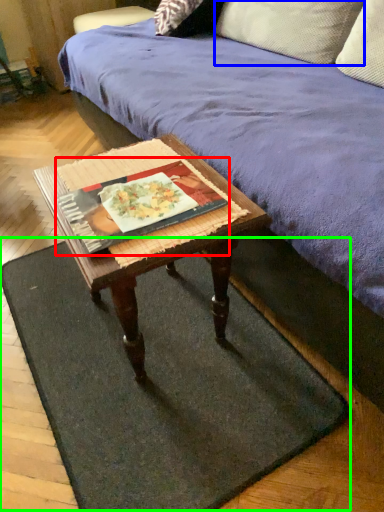
Question: Which is farther away from book (highlighted by a red box)? pillow (highlighted by a blue box) or doormat (highlighted by a green box)?

Choices:
 (A) pillow
 (B) doormat

Answer: (A)